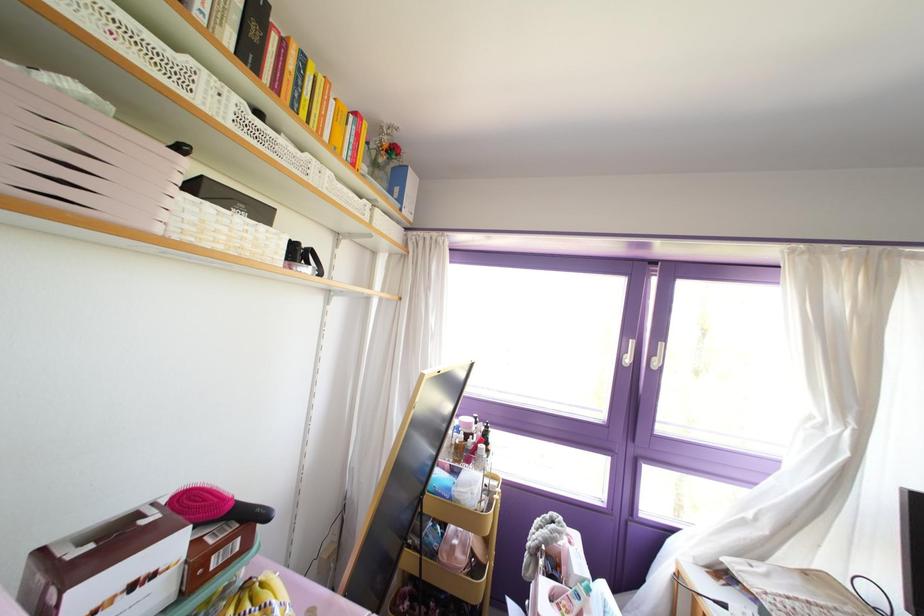
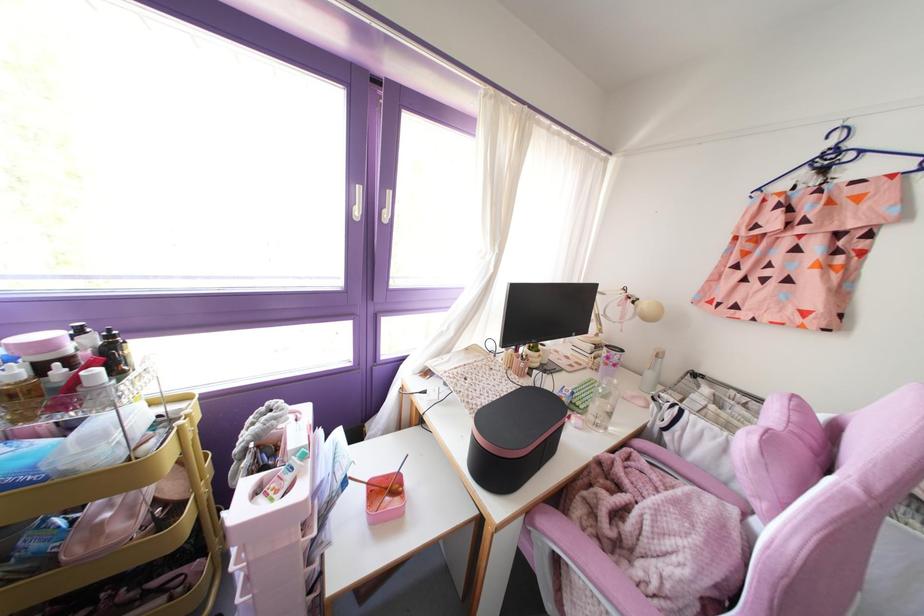
Locate, in the second image, the point that corresponds to (471,435) in the first image.

(67, 360)